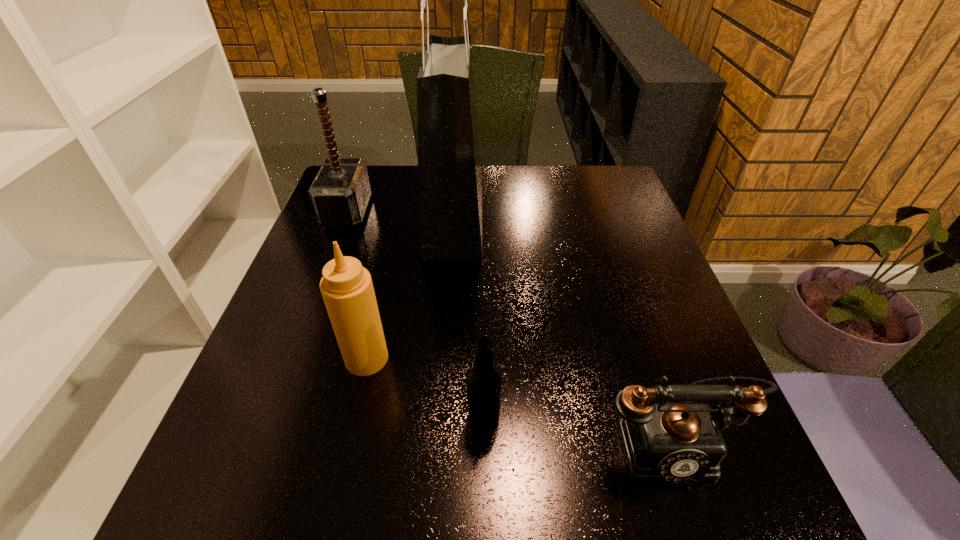
Locate an element on the screen. The image size is (960, 540). shopping bag positioned at the far edge is located at coordinates (x=450, y=185).

The image size is (960, 540). What are the coordinates of `hammer that is at the far edge` in the screenshot? It's located at (340, 192).

Find the location of a particular element. object positioned at the near edge is located at coordinates (674, 442).

The image size is (960, 540). I want to click on object located in the left edge section of the desktop, so click(340, 192).

Identify the location of object at the right edge. This screenshot has width=960, height=540. (674, 442).

Where is `object positioned at the far left corner`? The image size is (960, 540). object positioned at the far left corner is located at coordinates (340, 192).

Image resolution: width=960 pixels, height=540 pixels. I want to click on object that is at the near right corner, so click(x=674, y=442).

This screenshot has width=960, height=540. In order to click on blank space at the far edge of the desktop in this screenshot , I will do tap(561, 192).

Find the location of a particular element. free space at the near edge is located at coordinates (570, 529).

The height and width of the screenshot is (540, 960). Find the location of `free space at the left edge of the desktop`. free space at the left edge of the desktop is located at coordinates (325, 327).